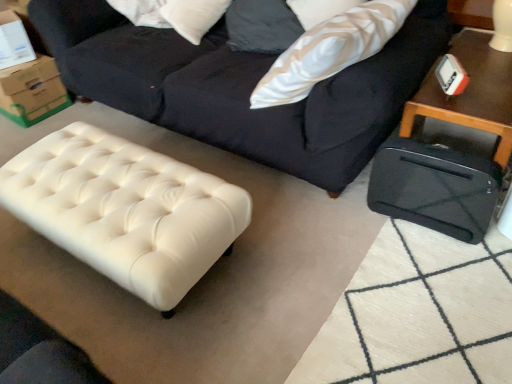
What do you see at coordinates (32, 91) in the screenshot?
I see `green cardboard box at upper left` at bounding box center [32, 91].

You are a GUI agent. You are given a task and a screenshot of the screen. Output one action in this format:
    pyautogui.click(x=<x>, y=<y>)
    Task: Click on the white textured pillow at upper right
    This screenshot has width=512, height=384.
    Given the screenshot: What is the action you would take?
    pyautogui.click(x=330, y=50)

Consider the image. What is the approximate width of black plastic suitcase at right, arranged as the second table when viewed from the left?

It is 15.58 inches.

The height and width of the screenshot is (384, 512). I want to click on white leather ottoman at lower left, arranged as the second table when viewed from the right, so click(x=125, y=210).

Looking at this image, does white textured pillow at upper right come in front of black plastic suitcase at right, the 1th table when ordered from right to left?

No, white textured pillow at upper right is further to the viewer.

Is white textured pillow at upper right at the left side of black plastic suitcase at right, the 1th table when ordered from right to left?

Correct, you'll find white textured pillow at upper right to the left of black plastic suitcase at right, the 1th table when ordered from right to left.

From the image's perspective, between white textured pillow at upper right and black plastic suitcase at right, arranged as the second table when viewed from the left, who is located below?

From the image's view, black plastic suitcase at right, arranged as the second table when viewed from the left, is below.

Considering the sizes of objects white textured pillow at upper right and black plastic suitcase at right, the 1th table when ordered from right to left, in the image provided, who is wider, white textured pillow at upper right or black plastic suitcase at right, the 1th table when ordered from right to left,?

With larger width is white textured pillow at upper right.

Consider the image. Between dark blue fabric studio couch at upper center and white leather ottoman at lower left, marked as the 1th table in a left-to-right arrangement, which one has larger width?

white leather ottoman at lower left, marked as the 1th table in a left-to-right arrangement.

Can white leather ottoman at lower left, arranged as the second table when viewed from the right, be found inside dark blue fabric studio couch at upper center?

Definitely not — white leather ottoman at lower left, arranged as the second table when viewed from the right, is not inside dark blue fabric studio couch at upper center.

Which object is positioned more to the right, dark blue fabric studio couch at upper center or white leather ottoman at lower left, arranged as the second table when viewed from the right?

From the viewer's perspective, dark blue fabric studio couch at upper center appears more on the right side.

Is dark blue fabric studio couch at upper center not close to white leather ottoman at lower left, arranged as the second table when viewed from the right?

dark blue fabric studio couch at upper center is actually quite close to white leather ottoman at lower left, arranged as the second table when viewed from the right.

From the image's perspective, between black plastic suitcase at right, the 1th table when ordered from right to left, and dark blue fabric studio couch at upper center, who is located below?

From the image's view, black plastic suitcase at right, the 1th table when ordered from right to left, is below.

Is black plastic suitcase at right, the 1th table when ordered from right to left, wider than dark blue fabric studio couch at upper center?

No, black plastic suitcase at right, the 1th table when ordered from right to left, is not wider than dark blue fabric studio couch at upper center.

Is black plastic suitcase at right, arranged as the second table when viewed from the left, placed right next to dark blue fabric studio couch at upper center?

No, black plastic suitcase at right, arranged as the second table when viewed from the left, is not touching dark blue fabric studio couch at upper center.

Is point (432, 79) closer to viewer compared to point (316, 129)?

Yes, it is in front of point (316, 129).

Which is behind, point (384, 53) or point (44, 71)?

Point (44, 71)

Which object is wider, dark blue fabric studio couch at upper center or green cardboard box at upper left?

dark blue fabric studio couch at upper center.

Is dark blue fabric studio couch at upper center not inside green cardboard box at upper left?

dark blue fabric studio couch at upper center lies outside green cardboard box at upper left's area.

Is green cardboard box at upper left oriented away from white leather ottoman at lower left, arranged as the second table when viewed from the right?

No.

From the picture: Which is in front, green cardboard box at upper left or white leather ottoman at lower left, arranged as the second table when viewed from the right?

Positioned in front is white leather ottoman at lower left, arranged as the second table when viewed from the right.

Between point (41, 85) and point (125, 172), which one is positioned behind?

The point (41, 85) is farther.

Is green cardboard box at upper left inside or outside of white leather ottoman at lower left, arranged as the second table when viewed from the right?

green cardboard box at upper left is outside white leather ottoman at lower left, arranged as the second table when viewed from the right.

Does dark blue fabric studio couch at upper center have a larger size compared to black plastic suitcase at right, the 1th table when ordered from right to left?

Correct, dark blue fabric studio couch at upper center is larger in size than black plastic suitcase at right, the 1th table when ordered from right to left.

Is point (162, 98) less distant than point (473, 124)?

No, (162, 98) is behind (473, 124).

Is dark blue fabric studio couch at upper center closer to camera compared to black plastic suitcase at right, arranged as the second table when viewed from the left?

That is True.

From the image's perspective, is green cardboard box at upper left located beneath white textured pillow at upper right?

Yes, from the image's perspective, green cardboard box at upper left is beneath white textured pillow at upper right.

Is green cardboard box at upper left at the left side of white textured pillow at upper right?

Indeed, green cardboard box at upper left is positioned on the left side of white textured pillow at upper right.

From a real-world perspective, is green cardboard box at upper left over white textured pillow at upper right?

No, from a real-world perspective, green cardboard box at upper left is not on top of white textured pillow at upper right.

In order to click on throw pillow on the left side of black plastic suitcase at right, arranged as the second table when viewed from the left in this screenshot , I will do `click(330, 50)`.

From the image's perspective, starting from the dark blue fabric studio couch at upper center, which table is the 2nd one below? Please provide its 2D coordinates.

[(125, 210)]

When comparing their distances from white leather ottoman at lower left, marked as the 1th table in a left-to-right arrangement, does dark blue fabric studio couch at upper center or green cardboard box at upper left seem closer?

The object closer to white leather ottoman at lower left, marked as the 1th table in a left-to-right arrangement, is dark blue fabric studio couch at upper center.

Which object lies further to the anchor point white leather ottoman at lower left, arranged as the second table when viewed from the right, white textured pillow at upper right or green cardboard box at upper left?

The object further to white leather ottoman at lower left, arranged as the second table when viewed from the right, is green cardboard box at upper left.

Considering their positions, is black plastic suitcase at right, the 1th table when ordered from right to left, positioned closer to green cardboard box at upper left than white leather ottoman at lower left, marked as the 1th table in a left-to-right arrangement?

Among the two, white leather ottoman at lower left, marked as the 1th table in a left-to-right arrangement, is located nearer to green cardboard box at upper left.

When comparing their distances from green cardboard box at upper left, does white textured pillow at upper right or dark blue fabric studio couch at upper center seem closer?

Among the two, dark blue fabric studio couch at upper center is located nearer to green cardboard box at upper left.

Estimate the real-world distances between objects in this image. Which object is closer to white leather ottoman at lower left, marked as the 1th table in a left-to-right arrangement, dark blue fabric studio couch at upper center or white textured pillow at upper right?

dark blue fabric studio couch at upper center lies closer to white leather ottoman at lower left, marked as the 1th table in a left-to-right arrangement, than the other object.

When comparing their distances from white textured pillow at upper right, does green cardboard box at upper left or white leather ottoman at lower left, marked as the 1th table in a left-to-right arrangement, seem further?

green cardboard box at upper left lies further to white textured pillow at upper right than the other object.

Considering their positions, is white textured pillow at upper right positioned further to dark blue fabric studio couch at upper center than green cardboard box at upper left?

green cardboard box at upper left is further to dark blue fabric studio couch at upper center.

Looking at the image, which one is located further to black plastic suitcase at right, arranged as the second table when viewed from the left, green cardboard box at upper left or white textured pillow at upper right?

green cardboard box at upper left is positioned further to the anchor black plastic suitcase at right, arranged as the second table when viewed from the left.

At what (x,y) coordinates should I click in order to perform the action: click on table between green cardboard box at upper left and black plastic suitcase at right, the 1th table when ordered from right to left. Please return your answer as a coordinate pair (x, y). Looking at the image, I should click on (125, 210).

Identify the location of throw pillow situated between white leather ottoman at lower left, arranged as the second table when viewed from the right, and black plastic suitcase at right, the 1th table when ordered from right to left, from left to right. (330, 50).

The image size is (512, 384). What are the coordinates of `studio couch between green cardboard box at upper left and white textured pillow at upper right from left to right` in the screenshot? It's located at (242, 86).

This screenshot has height=384, width=512. I want to click on table between green cardboard box at upper left and dark blue fabric studio couch at upper center, so click(125, 210).